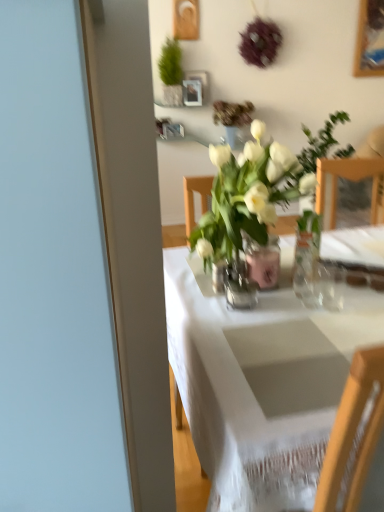
Question: Is green matte plant at upper center, which is the first houseplant from back to front, at the right side of clear glass vase at center, the 2th vase viewed from the back?

Choices:
 (A) yes
 (B) no

Answer: (B)

Question: Can you confirm if green matte plant at upper center, which is the first houseplant from back to front, is thinner than clear glass vase at center, acting as the first vase starting from the front?

Choices:
 (A) no
 (B) yes

Answer: (A)

Question: Is clear glass vase at center, acting as the first vase starting from the front, located within green matte plant at upper center, which ranks as the 2th houseplant in front-to-back order?

Choices:
 (A) yes
 (B) no

Answer: (B)

Question: Does green matte plant at upper center, which ranks as the 2th houseplant in front-to-back order, appear on the left side of clear glass vase at center, acting as the first vase starting from the front?

Choices:
 (A) yes
 (B) no

Answer: (A)

Question: From a real-world perspective, does green matte plant at upper center, which is the 2th houseplant in right-to-left order, stand above clear glass vase at center, the 2th vase viewed from the back?

Choices:
 (A) yes
 (B) no

Answer: (A)

Question: Is white glass vase at center, which ranks as the second houseplant in top-to-bottom order, in front of or behind pink glass vase at center, the second vase from the front, in the image?

Choices:
 (A) behind
 (B) front

Answer: (B)

Question: Do you think white glass vase at center, which is the first houseplant from front to back, is within pink glass vase at center, which appears as the 1th vase when viewed from the back, or outside of it?

Choices:
 (A) inside
 (B) outside

Answer: (B)

Question: From a real-world perspective, is white glass vase at center, which is the first houseplant from front to back, positioned above or below pink glass vase at center, which appears as the 1th vase when viewed from the back?

Choices:
 (A) above
 (B) below

Answer: (A)

Question: Considering the positions of point coord(279,150) and point coord(271,286), is point coord(279,150) closer or farther from the camera than point coord(271,286)?

Choices:
 (A) closer
 (B) farther

Answer: (B)

Question: Is pink glass vase at center, which appears as the 1th vase when viewed from the back, in front of or behind green matte plant at upper center, which ranks as the 2th houseplant in front-to-back order, in the image?

Choices:
 (A) front
 (B) behind

Answer: (A)

Question: Would you say pink glass vase at center, the second vase from the front, is to the left or to the right of green matte plant at upper center, the first houseplant positioned from the left, in the picture?

Choices:
 (A) right
 (B) left

Answer: (A)

Question: Is point (253, 253) positioned closer to the camera than point (180, 101)?

Choices:
 (A) farther
 (B) closer

Answer: (B)

Question: Do you think pink glass vase at center, which appears as the 1th vase when viewed from the back, is within green matte plant at upper center, marked as the first houseplant in a top-to-bottom arrangement, or outside of it?

Choices:
 (A) outside
 (B) inside

Answer: (A)

Question: Is clear glass vase at center, acting as the first vase starting from the front, wider or thinner than pink glass vase at center, which appears as the 1th vase when viewed from the back?

Choices:
 (A) wide
 (B) thin

Answer: (B)

Question: In the image, is clear glass vase at center, the 2th vase viewed from the back, positioned in front of or behind pink glass vase at center, the second vase from the front?

Choices:
 (A) front
 (B) behind

Answer: (A)